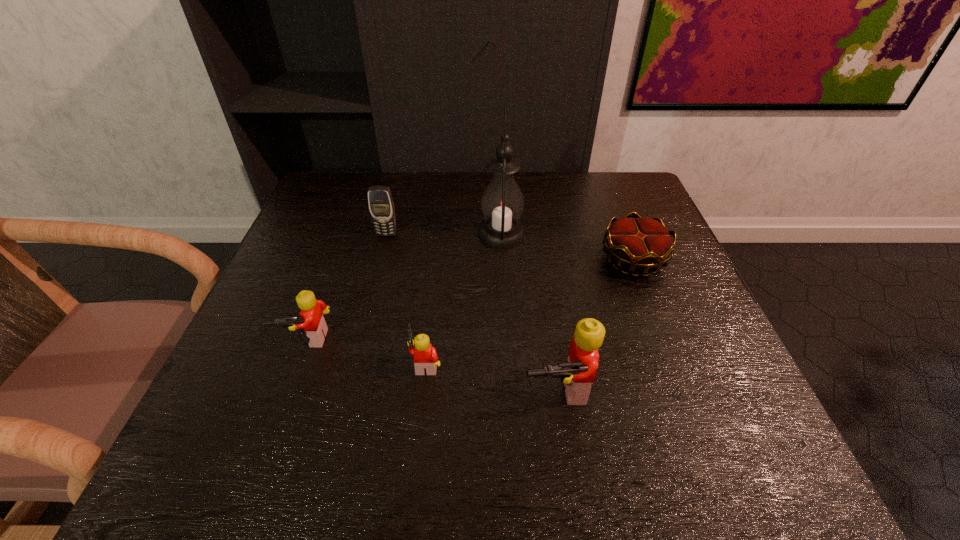
You are a GUI agent. You are given a task and a screenshot of the screen. Output one action in this format:
    pyautogui.click(x=<x>, y=<y>)
    Task: Click on the free space located 0.070m in front of the second shortest Lego with the accessory visible
    The image size is (960, 540).
    Given the screenshot: What is the action you would take?
    pyautogui.click(x=291, y=387)

Locate an element on the screen. vacant space located in front of the third object from left to right with the accessory visible is located at coordinates pyautogui.click(x=228, y=363).

Locate an element on the screen. The width and height of the screenshot is (960, 540). vacant space located in front of the third object from left to right with the accessory visible is located at coordinates (271, 363).

The image size is (960, 540). Identify the location of vacant space located in front of the third object from left to right with the accessory visible. (244, 363).

Identify the location of free space located 0.250m on the back of the crown. This screenshot has height=540, width=960. (605, 186).

The image size is (960, 540). I want to click on blank area located on the front of the oil lamp, so click(x=508, y=341).

You are a GUI agent. You are given a task and a screenshot of the screen. Output one action in this format:
    pyautogui.click(x=<x>, y=<y>)
    Task: Click on the vacant region located 0.080m on the front face of the cellular telephone
    This screenshot has height=540, width=960.
    Given the screenshot: What is the action you would take?
    pyautogui.click(x=380, y=259)

Identify the location of object located at the far edge. (502, 203).

Find the location of a particular element. The width and height of the screenshot is (960, 540). object that is positioned at the left edge is located at coordinates (312, 310).

Locate an element on the screen. The image size is (960, 540). object present at the right edge is located at coordinates (640, 243).